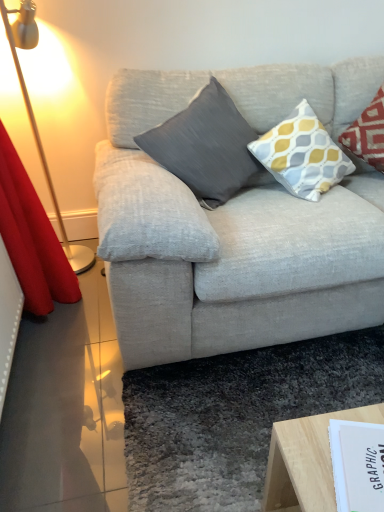
Question: Does yellow and gray patterned pillow at upper right, the second pillow in the left-to-right sequence, appear on the left side of matte gray pillow at center, the 2th pillow viewed from the right?

Choices:
 (A) yes
 (B) no

Answer: (B)

Question: Is yellow and gray patterned pillow at upper right, the second pillow in the left-to-right sequence, surrounding matte gray pillow at center, the 2th pillow viewed from the right?

Choices:
 (A) yes
 (B) no

Answer: (B)

Question: Does yellow and gray patterned pillow at upper right, marked as the first pillow in a right-to-left arrangement, have a greater height compared to matte gray pillow at center, placed as the 1th pillow when sorted from left to right?

Choices:
 (A) no
 (B) yes

Answer: (A)

Question: Is yellow and gray patterned pillow at upper right, marked as the first pillow in a right-to-left arrangement, outside matte gray pillow at center, the 2th pillow viewed from the right?

Choices:
 (A) yes
 (B) no

Answer: (A)

Question: Does yellow and gray patterned pillow at upper right, marked as the first pillow in a right-to-left arrangement, have a lesser height compared to matte gray pillow at center, the 2th pillow viewed from the right?

Choices:
 (A) yes
 (B) no

Answer: (A)

Question: Does yellow and gray patterned pillow at upper right, marked as the first pillow in a right-to-left arrangement, lie in front of matte gray pillow at center, placed as the 1th pillow when sorted from left to right?

Choices:
 (A) yes
 (B) no

Answer: (B)

Question: Considering the relative sizes of matte gray pillow at center, placed as the 1th pillow when sorted from left to right, and metallic gold floor lamp at left in the image provided, is matte gray pillow at center, placed as the 1th pillow when sorted from left to right, thinner than metallic gold floor lamp at left?

Choices:
 (A) yes
 (B) no

Answer: (B)

Question: Considering the relative positions of matte gray pillow at center, placed as the 1th pillow when sorted from left to right, and metallic gold floor lamp at left in the image provided, is matte gray pillow at center, placed as the 1th pillow when sorted from left to right, to the left of metallic gold floor lamp at left from the viewer's perspective?

Choices:
 (A) no
 (B) yes

Answer: (A)

Question: Considering the relative sizes of matte gray pillow at center, the 2th pillow viewed from the right, and metallic gold floor lamp at left in the image provided, is matte gray pillow at center, the 2th pillow viewed from the right, wider than metallic gold floor lamp at left?

Choices:
 (A) yes
 (B) no

Answer: (A)

Question: Considering the relative sizes of matte gray pillow at center, placed as the 1th pillow when sorted from left to right, and metallic gold floor lamp at left in the image provided, is matte gray pillow at center, placed as the 1th pillow when sorted from left to right, shorter than metallic gold floor lamp at left?

Choices:
 (A) no
 (B) yes

Answer: (B)

Question: Is metallic gold floor lamp at left at the back of matte gray pillow at center, placed as the 1th pillow when sorted from left to right?

Choices:
 (A) yes
 (B) no

Answer: (B)

Question: Are matte gray pillow at center, the 2th pillow viewed from the right, and metallic gold floor lamp at left far apart?

Choices:
 (A) yes
 (B) no

Answer: (B)

Question: Does white paper at lower right have a larger size compared to metallic gold floor lamp at left?

Choices:
 (A) yes
 (B) no

Answer: (B)